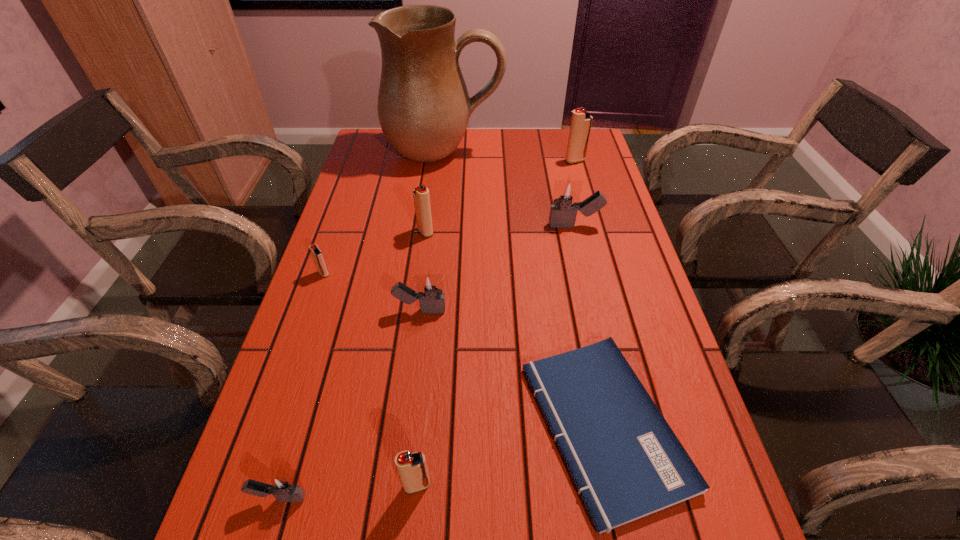
Where is `the fourth nearest igniter`? This screenshot has width=960, height=540. the fourth nearest igniter is located at coordinates (318, 257).

You are a GUI agent. You are given a task and a screenshot of the screen. Output one action in this format:
    pyautogui.click(x=<x>, y=<y>)
    Task: Click on the leftmost gray igniter
    
    Given the screenshot: What is the action you would take?
    pyautogui.click(x=281, y=487)

You are a GUI agent. You are given a task and a screenshot of the screen. Output one action in this format:
    pyautogui.click(x=<x>, y=<y>)
    Task: Click on the smallest gray igniter
    Image resolution: width=960 pixels, height=540 pixels.
    Given the screenshot: What is the action you would take?
    pyautogui.click(x=281, y=487)

In order to click on blue paperback book in this screenshot , I will do (x=626, y=462).

Identify the location of paperback book. (626, 462).

Locate an element on the screen. vacant area situated 0.100m at the spout of the tallest object is located at coordinates (440, 193).

Where is `free space located 0.170m on the back of the second tallest object`? The height and width of the screenshot is (540, 960). free space located 0.170m on the back of the second tallest object is located at coordinates (567, 132).

Where is `vacant space situated 0.090m on the right of the third nearest red igniter`? Image resolution: width=960 pixels, height=540 pixels. vacant space situated 0.090m on the right of the third nearest red igniter is located at coordinates (467, 232).

This screenshot has width=960, height=540. What are the coordinates of `vacant space located 0.340m on the back of the biggest gray igniter` in the screenshot? It's located at (558, 154).

Locate an element on the screen. This screenshot has height=540, width=960. free space located 0.230m on the back of the sixth farthest object is located at coordinates (429, 235).